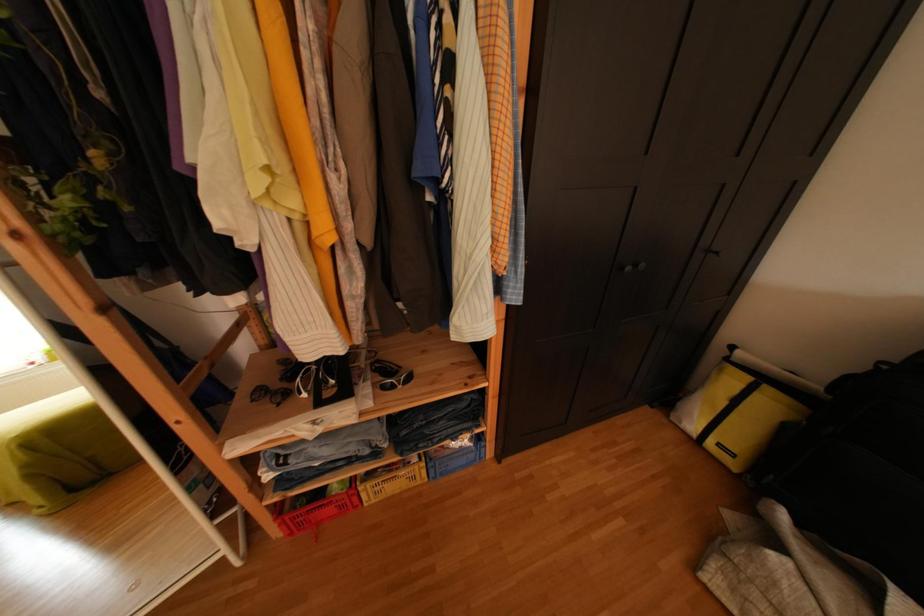
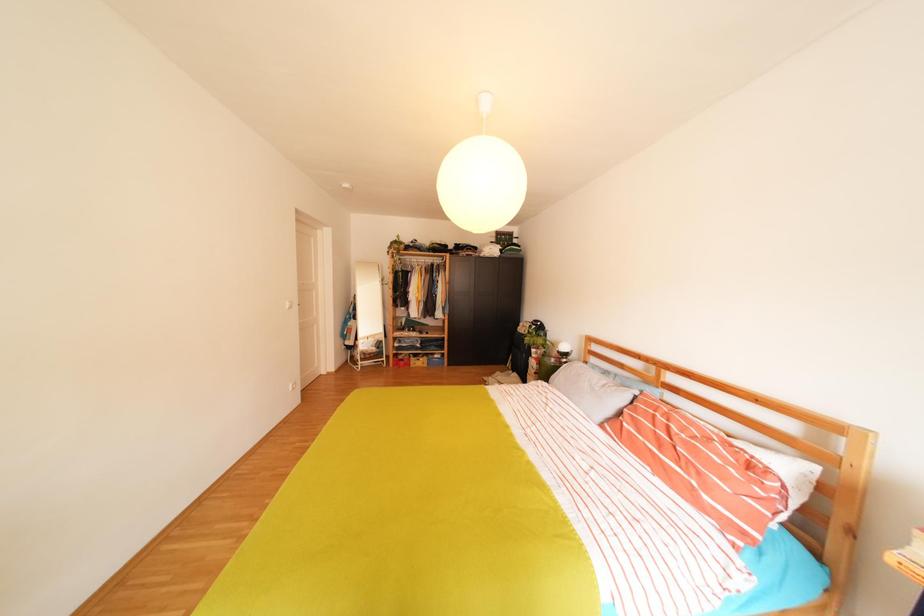
From the picture: The images are taken continuously from a first-person perspective. In which direction are you moving?

The movement direction of the cameraman is right, backward.